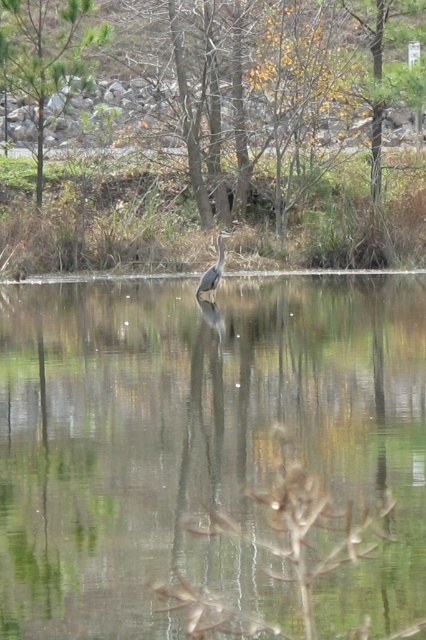
Question: Which of the following is the farthest from the observer?

Choices:
 (A) clear water at center
 (B) gray matte bird at center
 (C) brown textured tree at upper center
 (D) green matte tree at upper left

Answer: (C)

Question: Is clear water at center above brown textured tree at upper center?

Choices:
 (A) yes
 (B) no

Answer: (B)

Question: Which object appears closest to the camera in this image?

Choices:
 (A) gray matte bird at center
 (B) green matte tree at upper left

Answer: (A)

Question: Considering the relative positions of brown textured tree at upper center and gray matte bird at center in the image provided, where is brown textured tree at upper center located with respect to gray matte bird at center?

Choices:
 (A) below
 (B) above

Answer: (B)

Question: Where is brown textured tree at upper center located in relation to gray matte bird at center in the image?

Choices:
 (A) right
 (B) left

Answer: (A)

Question: Considering the real-world distances, which object is closest to the gray matte bird at center?

Choices:
 (A) clear water at center
 (B) green matte tree at upper left
 (C) brown textured tree at upper center

Answer: (A)